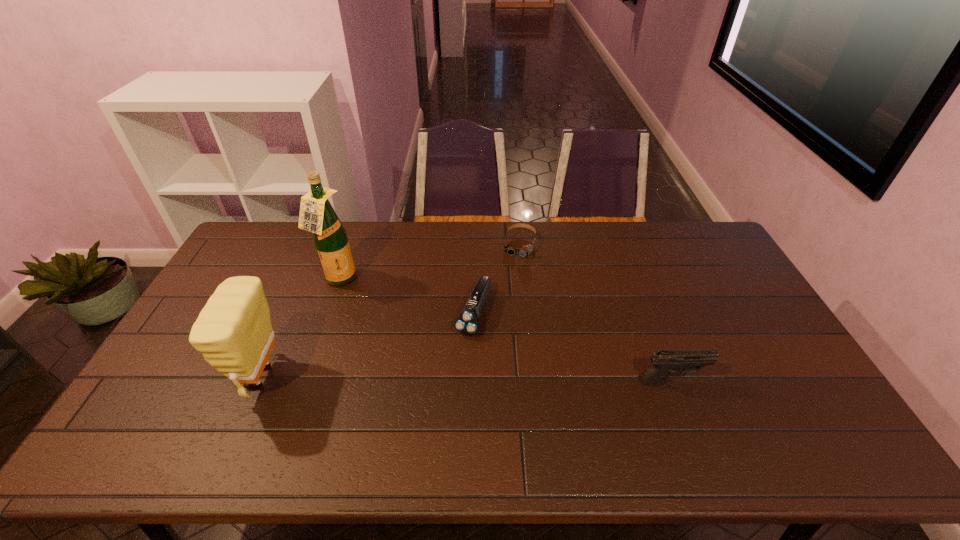
Locate an element on the screen. The image size is (960, 540). free space that is in between the fourth object from left to right and the tallest object is located at coordinates (429, 262).

This screenshot has height=540, width=960. I want to click on empty space that is in between the sponge and the liquor, so click(x=300, y=328).

Identify the location of unoccupied area between the third shortest object and the fourth shortest object. This screenshot has width=960, height=540. [x=466, y=379].

Where is `empty location between the tallest object and the second tallest object`? This screenshot has height=540, width=960. empty location between the tallest object and the second tallest object is located at coordinates (300, 328).

You are a GUI agent. You are given a task and a screenshot of the screen. Output one action in this format:
    pyautogui.click(x=<x>, y=<y>)
    Task: Click on the unoccupied area between the tallest object and the shortest object
    The width and height of the screenshot is (960, 540).
    Given the screenshot: What is the action you would take?
    pyautogui.click(x=429, y=262)

Where is `empty space between the fourth shortest object and the liquor`? Image resolution: width=960 pixels, height=540 pixels. empty space between the fourth shortest object and the liquor is located at coordinates (300, 328).

The image size is (960, 540). In order to click on vacant space in between the tallest object and the shortest object in this screenshot , I will do `click(429, 262)`.

Image resolution: width=960 pixels, height=540 pixels. Identify the location of the closest object to the farthest object. (467, 323).

Locate which object is the third closest to the second shortest object. Please provide its 2D coordinates. Your answer should be formatted as a tuple, i.e. [(x, y)], where the tuple contains the x and y coordinates of a point satisfying the conditions above.

[(664, 362)]

Where is `free location that satisfies the following two spatial constraints: 1. on the front side of the second object from right to left; 2. at the barrel of the pistol`? The width and height of the screenshot is (960, 540). free location that satisfies the following two spatial constraints: 1. on the front side of the second object from right to left; 2. at the barrel of the pistol is located at coordinates (535, 381).